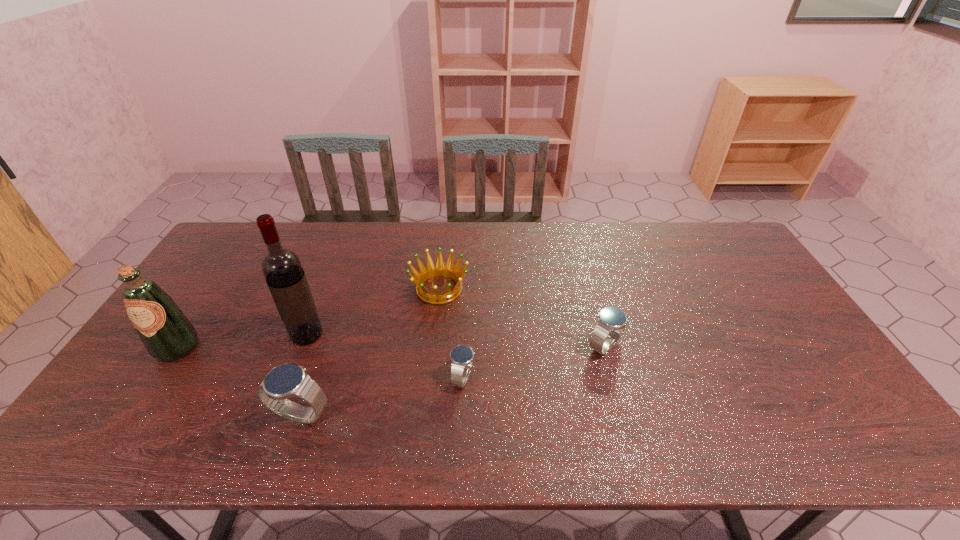
I want to click on vacant space located on the right of the shortest watch, so tap(502, 377).

Identify the location of vacant space situated on the left of the rightmost watch. (560, 346).

Where is `free space located 0.080m on the front-facing side of the olive oil`? The height and width of the screenshot is (540, 960). free space located 0.080m on the front-facing side of the olive oil is located at coordinates (149, 390).

The height and width of the screenshot is (540, 960). Identify the location of free space located 0.080m on the right of the tallest object. (351, 335).

In order to click on vacant space located on the front of the farthest object in this screenshot , I will do 428,397.

Where is `object that is at the left edge`? object that is at the left edge is located at coordinates (167, 334).

In the image, there is a desktop. Where is `free space at the far edge`? The image size is (960, 540). free space at the far edge is located at coordinates (310, 231).

The height and width of the screenshot is (540, 960). I want to click on free space at the near edge of the desktop, so click(x=594, y=400).

Locate an element on the screen. Image resolution: width=960 pixels, height=540 pixels. vacant point at the left edge is located at coordinates (221, 286).

Find the location of a particular element. This screenshot has height=540, width=960. free space at the right edge is located at coordinates (756, 286).